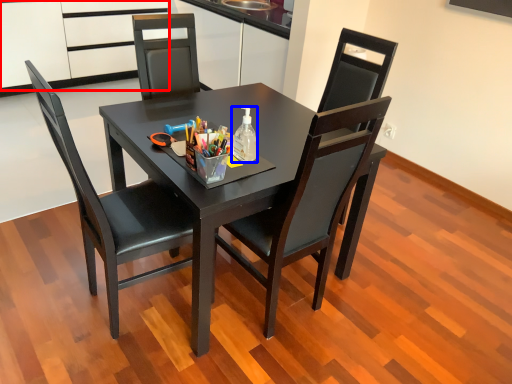
Question: Which object appears farthest to the camera in this image, cabinetry (highlighted by a red box) or bottle (highlighted by a blue box)?

Choices:
 (A) cabinetry
 (B) bottle

Answer: (A)